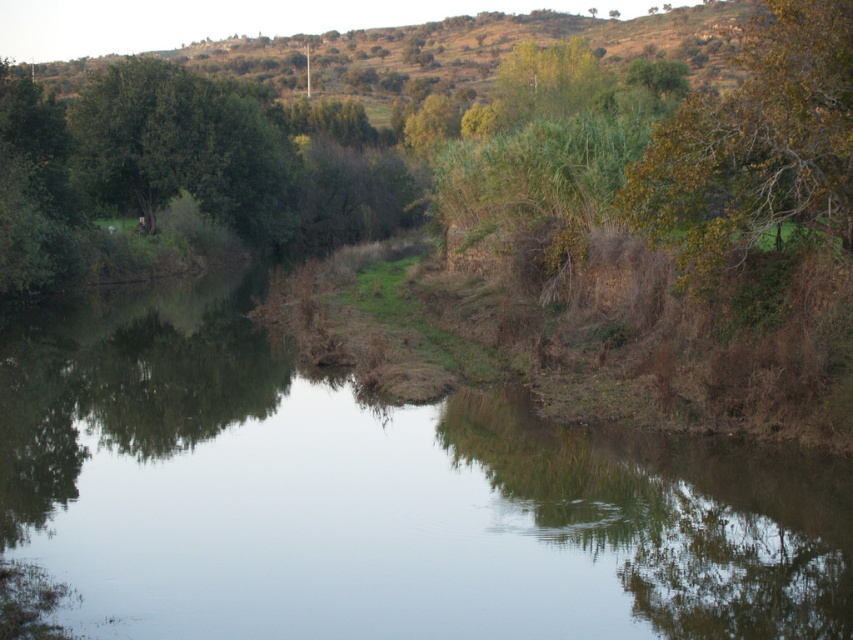
Question: Which point is farther to the camera?

Choices:
 (A) green grassy bank at center
 (B) green leafy tree at upper right

Answer: (B)

Question: Does green grassy bank at center have a smaller size compared to green leafy tree at upper right?

Choices:
 (A) no
 (B) yes

Answer: (B)

Question: Does green grassy bank at center have a larger size compared to green leafy tree at upper right?

Choices:
 (A) yes
 (B) no

Answer: (B)

Question: Does green grassy bank at center appear on the right side of green leafy tree at upper right?

Choices:
 (A) yes
 (B) no

Answer: (B)

Question: Which of the following is the farthest from the observer?

Choices:
 (A) (689, 108)
 (B) (76, 490)

Answer: (A)